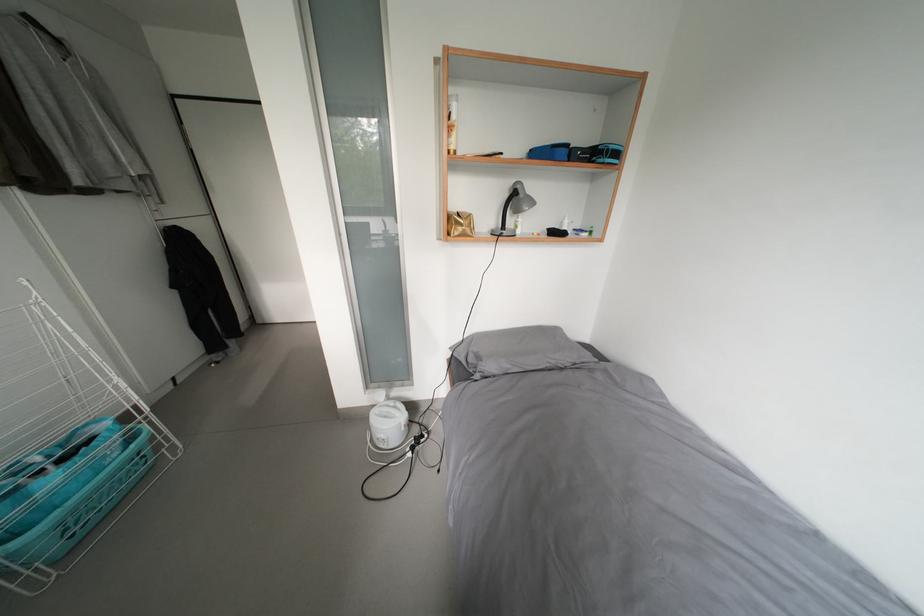
You are a GUI agent. You are given a task and a screenshot of the screen. Output one action in this format:
    pyautogui.click(x=<x>, y=<y>)
    Task: Click on the grey lamp head
    The height and width of the screenshot is (616, 924).
    Given the screenshot: What is the action you would take?
    pyautogui.click(x=519, y=199)